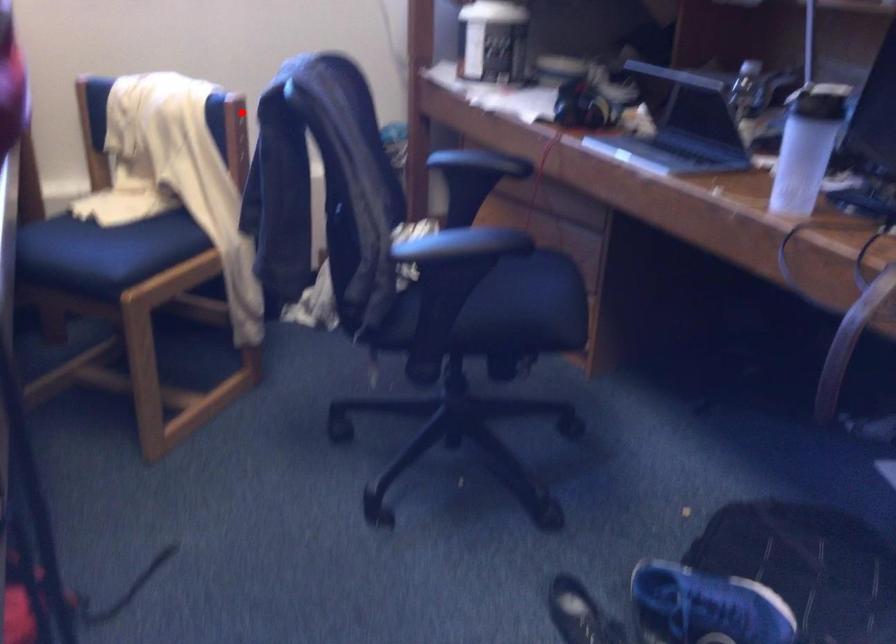
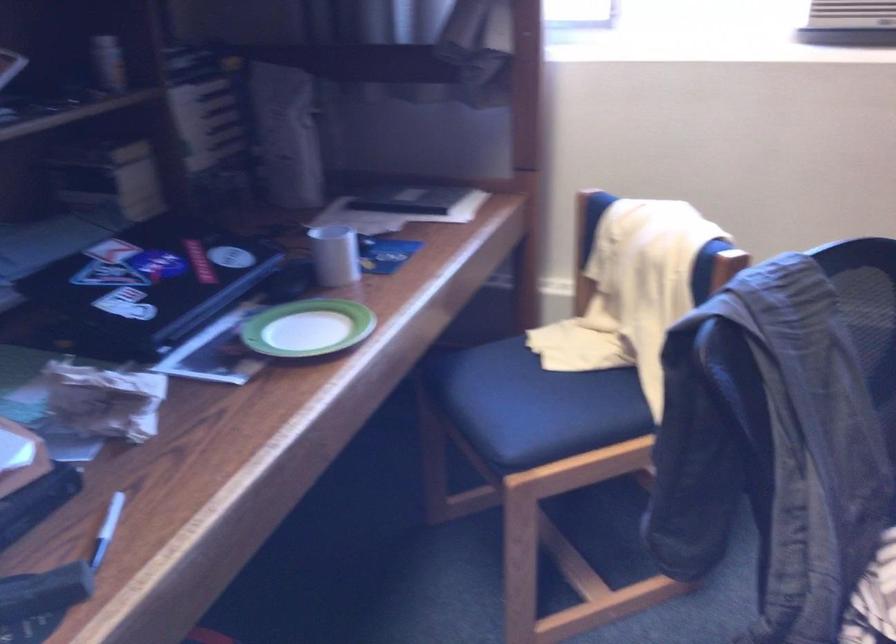
Question: I am providing you with two images of the same scene from different viewpoints. A red point is marked on the first image. Can you still see the location of the red point in image 2?

Choices:
 (A) Yes
 (B) No

Answer: (A)